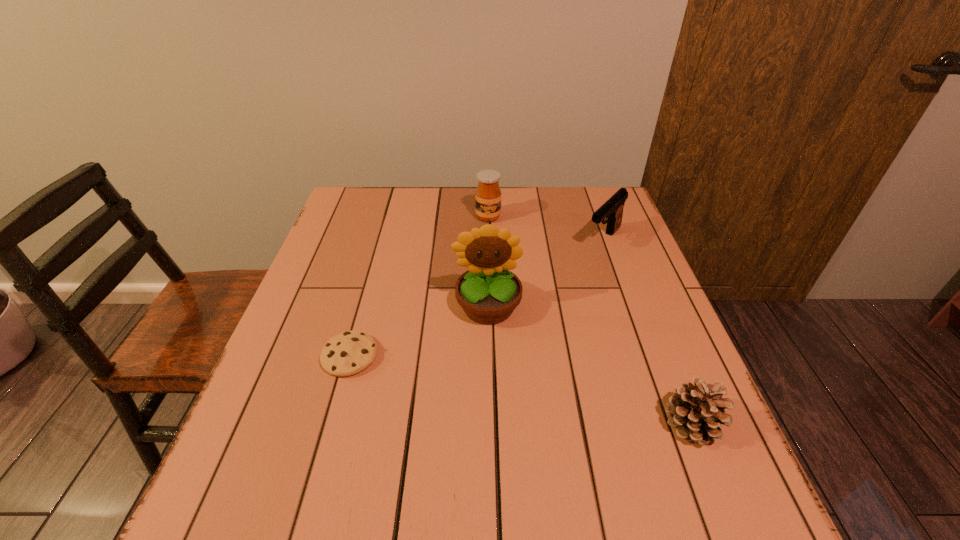
Where is `free space between the farthest object and the cookie`? free space between the farthest object and the cookie is located at coordinates (419, 287).

The height and width of the screenshot is (540, 960). In order to click on vacant point located between the second farthest object and the farthest object in this screenshot , I will do `click(545, 228)`.

Identify which object is the third nearest to the pistol. Please provide its 2D coordinates. Your answer should be formatted as a tuple, i.e. [(x, y)], where the tuple contains the x and y coordinates of a point satisfying the conditions above.

[(697, 411)]

Where is `the fourth closest object to the pistol`? The height and width of the screenshot is (540, 960). the fourth closest object to the pistol is located at coordinates (350, 352).

Find the location of a particular element. This screenshot has width=960, height=540. free point that satisfies the following two spatial constraints: 1. on the front side of the pistol; 2. on the left side of the honey is located at coordinates (489, 240).

The image size is (960, 540). In order to click on free point that satisfies the following two spatial constraints: 1. on the front side of the cookie; 2. on the right side of the nearest object in this screenshot , I will do `click(331, 423)`.